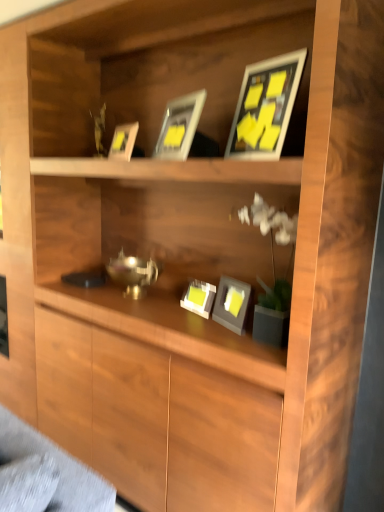
Question: Is matte gray picture frame at center, placed as the first picture frame when sorted from bottom to top, shorter than matte gray picture frame at center, the fourth picture frame from the top?

Choices:
 (A) no
 (B) yes

Answer: (B)

Question: Is the position of matte gray picture frame at center, which ranks as the fifth picture frame in top-to-bottom order, more distant than that of matte gray picture frame at center, which ranks as the second picture frame in bottom-to-top order?

Choices:
 (A) yes
 (B) no

Answer: (A)

Question: Considering the relative sizes of matte gray picture frame at center, placed as the first picture frame when sorted from bottom to top, and matte gray picture frame at center, which ranks as the second picture frame in bottom-to-top order, in the image provided, is matte gray picture frame at center, placed as the first picture frame when sorted from bottom to top, wider than matte gray picture frame at center, which ranks as the second picture frame in bottom-to-top order,?

Choices:
 (A) no
 (B) yes

Answer: (A)

Question: Can you confirm if matte gray picture frame at center, placed as the first picture frame when sorted from bottom to top, is taller than matte gray picture frame at center, which ranks as the second picture frame in bottom-to-top order?

Choices:
 (A) yes
 (B) no

Answer: (B)

Question: From a real-world perspective, is matte gray picture frame at center, placed as the first picture frame when sorted from bottom to top, on matte gray picture frame at center, which ranks as the second picture frame in bottom-to-top order?

Choices:
 (A) yes
 (B) no

Answer: (B)

Question: From a real-world perspective, is matte gray picture frame at center, which ranks as the second picture frame in bottom-to-top order, physically located above or below matte black picture frame at upper center, positioned as the fourth picture frame in bottom-to-top order?

Choices:
 (A) below
 (B) above

Answer: (A)

Question: Considering the positions of point (230, 313) and point (253, 118), is point (230, 313) closer or farther from the camera than point (253, 118)?

Choices:
 (A) closer
 (B) farther

Answer: (B)

Question: In terms of size, does matte gray picture frame at center, the fourth picture frame from the top, appear bigger or smaller than matte black picture frame at upper center, acting as the second picture frame starting from the top?

Choices:
 (A) small
 (B) big

Answer: (A)

Question: From the image's perspective, is matte gray picture frame at center, the fourth picture frame from the top, located above or below matte black picture frame at upper center, acting as the second picture frame starting from the top?

Choices:
 (A) above
 (B) below

Answer: (B)

Question: Based on their sizes in the image, would you say matte gray picture frame at center, placed as the first picture frame when sorted from bottom to top, is bigger or smaller than matte gray picture frame at center, which ranks as the second picture frame in bottom-to-top order?

Choices:
 (A) big
 (B) small

Answer: (B)

Question: Relative to matte gray picture frame at center, the fourth picture frame from the top, is matte gray picture frame at center, which ranks as the fifth picture frame in top-to-bottom order, in front or behind?

Choices:
 (A) behind
 (B) front

Answer: (A)

Question: Would you say matte gray picture frame at center, placed as the first picture frame when sorted from bottom to top, is to the left or to the right of matte gray picture frame at center, the fourth picture frame from the top, in the picture?

Choices:
 (A) left
 (B) right

Answer: (A)

Question: Considering the positions of point (198, 297) and point (218, 309), is point (198, 297) closer or farther from the camera than point (218, 309)?

Choices:
 (A) farther
 (B) closer

Answer: (A)

Question: In terms of width, does matte silver picture frame at upper center, which is counted as the 1th picture frame, starting from the top, look wider or thinner when compared to matte gray picture frame at center, the fourth picture frame from the top?

Choices:
 (A) wide
 (B) thin

Answer: (B)

Question: Is matte silver picture frame at upper center, marked as the 5th picture frame in a bottom-to-top arrangement, to the left or to the right of matte gray picture frame at center, the fourth picture frame from the top, in the image?

Choices:
 (A) left
 (B) right

Answer: (A)